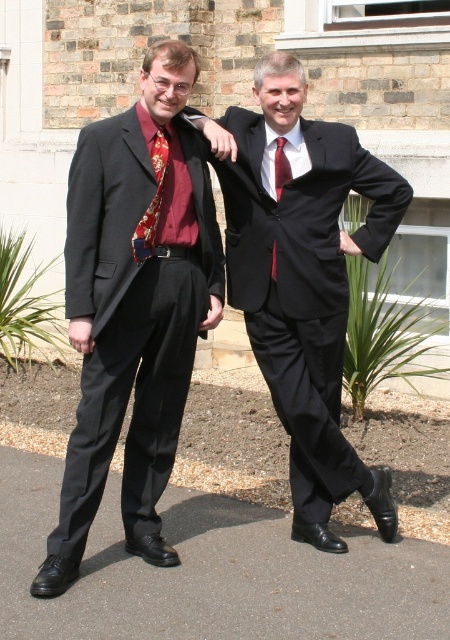
You are a tailor observing the two men in the scene. You need to determine which item, the matte black suit at center or the silky red tie at center, has a greater width. Which one is wider?

The matte black suit at center is wider than the silky red tie at center according to the description.